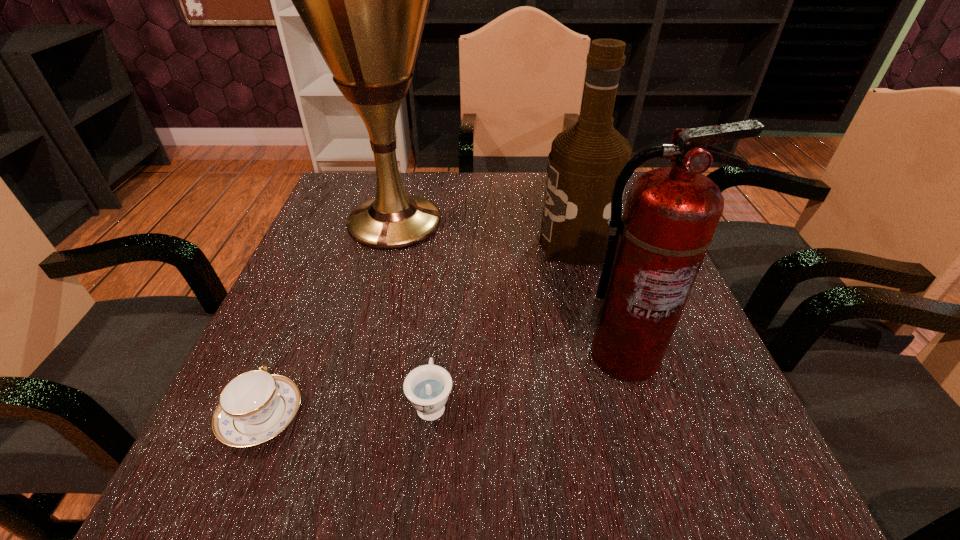
Image resolution: width=960 pixels, height=540 pixels. Identify the location of the tallest object. (364, 0).

Locate an element on the screen. alcohol is located at coordinates (585, 160).

Where is `fire extinguisher`? This screenshot has height=540, width=960. fire extinguisher is located at coordinates point(654,252).

Where is `the right teacup`? Image resolution: width=960 pixels, height=540 pixels. the right teacup is located at coordinates (427, 387).

Locate an element on the screen. Image resolution: width=960 pixels, height=540 pixels. the left teacup is located at coordinates (255, 406).

This screenshot has height=540, width=960. In order to click on free region located 0.120m on the front of the trophy cup in this screenshot , I will do `click(375, 299)`.

Where is `vacant space situated 0.180m on the label of the alcohol`? This screenshot has height=540, width=960. vacant space situated 0.180m on the label of the alcohol is located at coordinates (457, 244).

I want to click on blank space located 0.050m on the label of the alcohol, so (517, 244).

Locate an element on the screen. Image resolution: width=960 pixels, height=540 pixels. blank space located 0.050m on the label of the alcohol is located at coordinates (517, 244).

Locate an element on the screen. This screenshot has width=960, height=540. vacant space located on the nozzle side of the fire extinguisher is located at coordinates (673, 516).